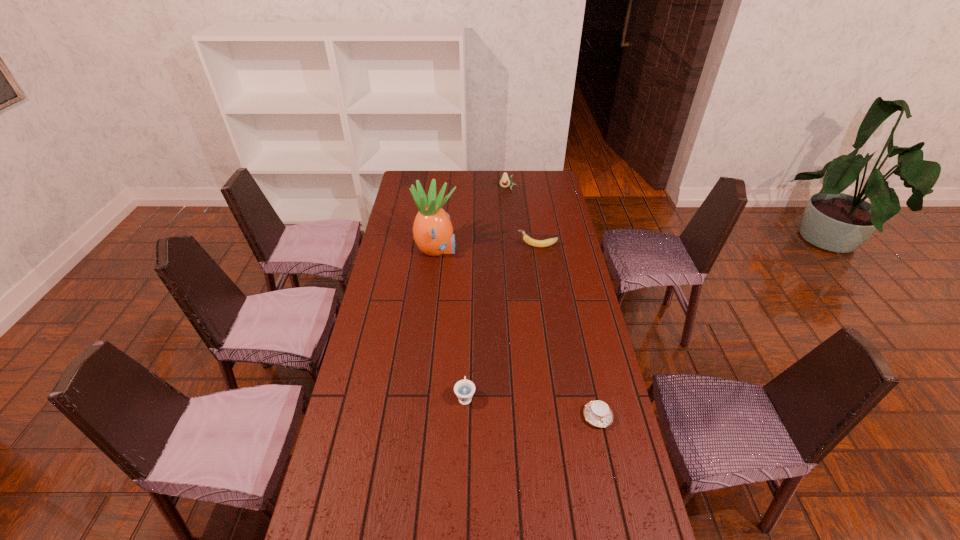
Where is `the tallest object`? The image size is (960, 540). the tallest object is located at coordinates (x=432, y=229).

The image size is (960, 540). What are the coordinates of `the leftmost object` in the screenshot? It's located at (432, 229).

This screenshot has width=960, height=540. In order to click on the farthest object in this screenshot , I will do `click(505, 181)`.

I want to click on banana, so click(x=536, y=243).

This screenshot has height=540, width=960. What are the coordinates of `the second shortest object` in the screenshot? It's located at (464, 389).

Find the location of `the fourth object from right to left`. the fourth object from right to left is located at coordinates (464, 389).

The image size is (960, 540). What are the coordinates of `the right teacup` in the screenshot? It's located at (597, 413).

The image size is (960, 540). In order to click on the shorter teacup in this screenshot , I will do `click(597, 413)`.

Where is `free space located at the entrance of the tallest object`? Image resolution: width=960 pixels, height=540 pixels. free space located at the entrance of the tallest object is located at coordinates (522, 250).

In order to click on vacant space situated on the seed side of the farthest object in this screenshot , I will do [510, 211].